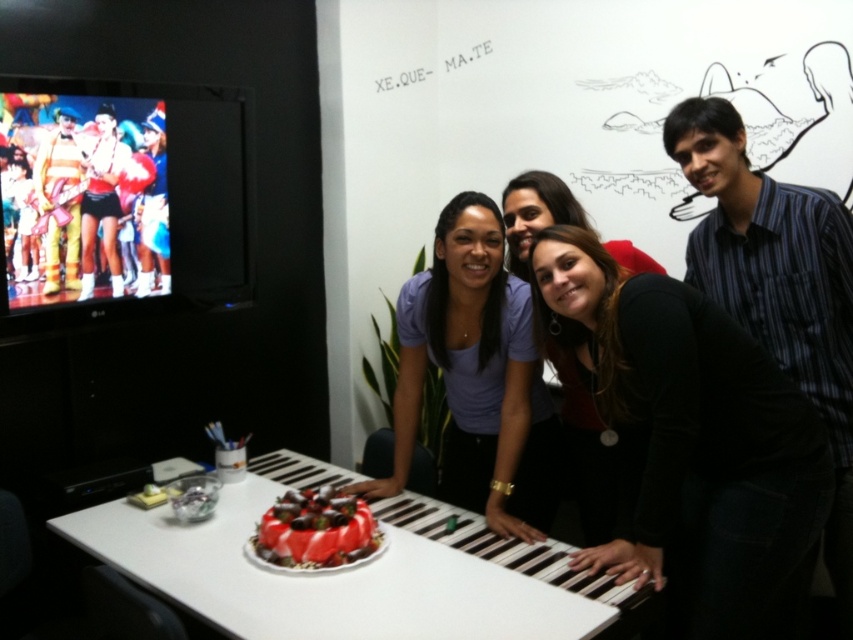
Is point (701, 285) farther from viewer compared to point (323, 557)?

Yes, point (701, 285) is farther from viewer.

Is point (734, 189) positioned in front of point (283, 540)?

No, (734, 189) is further to viewer.

The width and height of the screenshot is (853, 640). What are the coordinates of `striped cotton shirt at right` in the screenshot? It's located at (776, 285).

Does purple matte shirt at center have a lesser width compared to smooth glossy red cake at center?

In fact, purple matte shirt at center might be wider than smooth glossy red cake at center.

Based on the photo, is purple matte shirt at center wider than smooth glossy red cake at center?

Indeed, purple matte shirt at center has a greater width compared to smooth glossy red cake at center.

Image resolution: width=853 pixels, height=640 pixels. What do you see at coordinates (476, 378) in the screenshot? I see `purple matte shirt at center` at bounding box center [476, 378].

Where is `purple matte shirt at center`? purple matte shirt at center is located at coordinates (476, 378).

Which is more to the right, black matte piano keys at center or purple matte shirt at center?

black matte piano keys at center is more to the right.

Find the location of a particular element. black matte piano keys at center is located at coordinates (689, 442).

At what (x,y) coordinates should I click in order to perform the action: click on black matte piano keys at center. Please return your answer as a coordinate pair (x, y). Looking at the image, I should click on (689, 442).